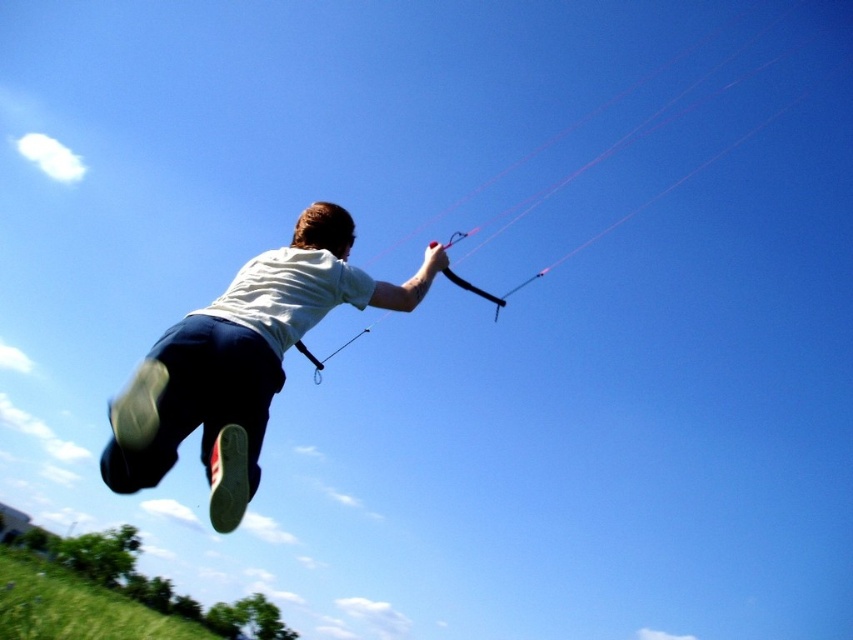
You are standing at the edge of the green grassy hillside at lower left and want to throw a frisbee to someone near the white cotton shirt at center. Which direction should you aim to ensure the frisbee reaches them?

You should aim towards the white cotton shirt at center because it is closer to you than the green grassy hillside at lower left.

You are a photographer trying to capture the perfect shot of the person kiteboarding. You notice the green grassy hillside at lower left and the black matte parachute at upper center in your viewfinder. Which object is located to the left of the other?

The green grassy hillside at lower left is positioned on the left side of black matte parachute at upper center.